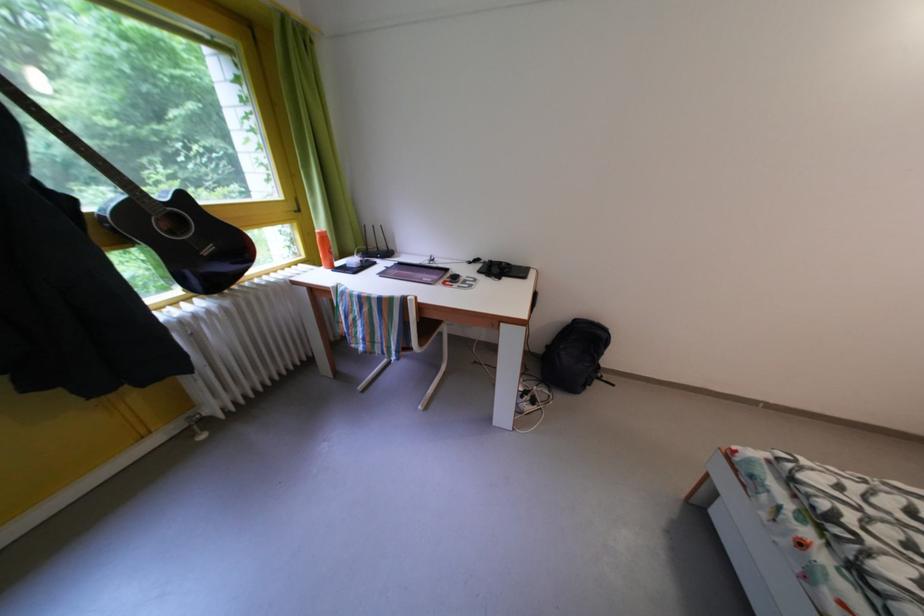
Find where to grasp the orange bottle. Please return your answer as a coordinate pair (x, y).

(323, 248)